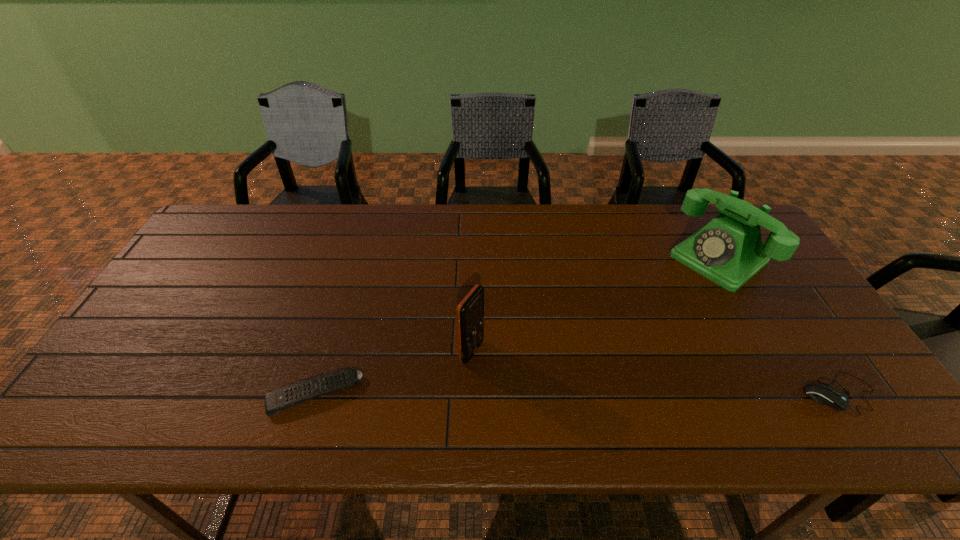
Locate an element on the screen. The width and height of the screenshot is (960, 540). free spot on the desktop that is between the remote control and the computer mouse and is positioned on the dial of the telephone is located at coordinates (544, 393).

In order to click on free space on the desktop that is between the shortest object and the computer mouse and is positioned on the screen of the second object from left to right in this screenshot , I will do `click(557, 393)`.